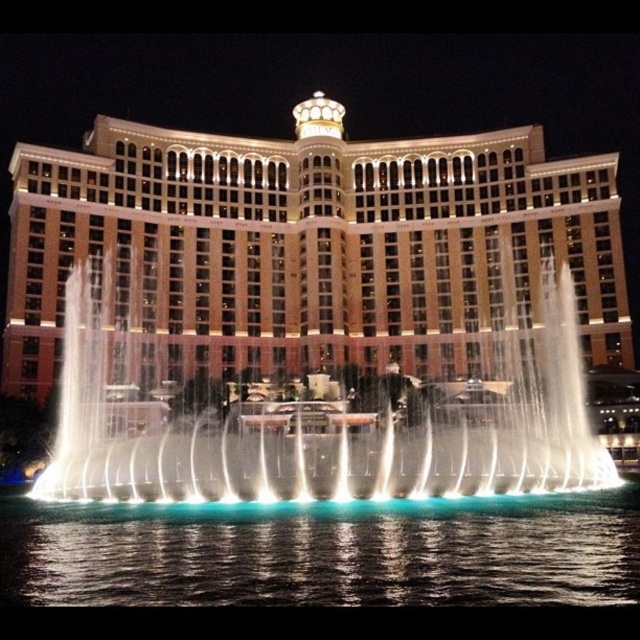
You are standing in front of the illuminated tan building at center. You want to take a photo of the building with your camera. The camera requires you to be at least 70 meters away to capture the entire structure in one shot. Can you do it?

The illuminated tan building at center and camera are 69.29 meters apart from each other. Since the required distance is 70 meters, you are too close to capture the entire structure in one shot.

You are a photographer standing at the front of the grand building. You want to capture both the white water at center and the blue liquid water at lower center in a single shot. Which water feature will appear larger in the photo?

The white water at center will appear larger in the photo because it is larger in size than the blue liquid water at lower center.

You are a drone operator tasked with capturing aerial footage of the illuminated tan building at center and the blue liquid water at lower center. Your drone has a maximum flight range of 30 meters. Can you fly the drone from the building to the water without exceeding its range?

The distance between the illuminated tan building at center and the blue liquid water at lower center is 35.24 meters, which exceeds the drone maximum flight range of 30 meters. Therefore, the drone cannot fly from the building to the water without exceeding its range.